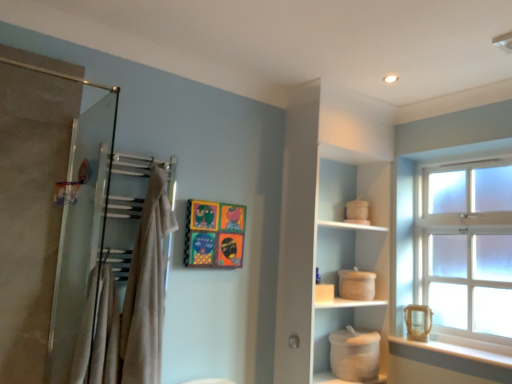
What is the approximate height of beige cotton bath towel at left, which appears as the first bath towel when viewed from the left?

The height of beige cotton bath towel at left, which appears as the first bath towel when viewed from the left, is 22.05 inches.

This screenshot has width=512, height=384. In order to click on white matte pot at lower center in this screenshot , I will do `click(342, 328)`.

You are a GUI agent. You are given a task and a screenshot of the screen. Output one action in this format:
    pyautogui.click(x=<x>, y=<y>)
    Task: Click on the wooden painted picture frame at upper center
    The image size is (512, 384).
    Given the screenshot: What is the action you would take?
    pyautogui.click(x=214, y=234)

Measure the distance between point (446, 264) and camera.

Point (446, 264) is 9.39 feet away from camera.

Describe the element at coordinates (146, 288) in the screenshot. I see `beige cotton bath towel at upper left, marked as the first bath towel in a right-to-left arrangement` at that location.

I want to click on beige cotton bath towel at left, which appears as the first bath towel when viewed from the left, so click(x=98, y=332).

The width and height of the screenshot is (512, 384). I want to click on picture frame above the white matte cabinet at center (from a real-world perspective), so click(x=214, y=234).

Could you tell me if white matte cabinet at center is turned towards wooden painted picture frame at upper center?

No, white matte cabinet at center is not oriented towards wooden painted picture frame at upper center.

Is white matte cabinet at center inside or outside of wooden painted picture frame at upper center?

The correct answer is: outside.

Considering the relative sizes of white matte cabinet at center and wooden painted picture frame at upper center in the image provided, is white matte cabinet at center wider than wooden painted picture frame at upper center?

Correct, the width of white matte cabinet at center exceeds that of wooden painted picture frame at upper center.

Is beige cotton bath towel at left, acting as the second bath towel starting from the right, aimed at white smooth window sill at lower right?

No, beige cotton bath towel at left, acting as the second bath towel starting from the right, is not turned towards white smooth window sill at lower right.

In the image, is beige cotton bath towel at left, which appears as the first bath towel when viewed from the left, positioned in front of or behind white smooth window sill at lower right?

beige cotton bath towel at left, which appears as the first bath towel when viewed from the left, is positioned closer to the viewer than white smooth window sill at lower right.

From the image's perspective, which is below, beige cotton bath towel at left, acting as the second bath towel starting from the right, or white smooth window sill at lower right?

From the image's view, white smooth window sill at lower right is below.

Can you tell me how much white matte pot at lower center and beige cotton bath towel at upper left, which is the second bath towel in left-to-right order, differ in facing direction?

The facing directions of white matte pot at lower center and beige cotton bath towel at upper left, which is the second bath towel in left-to-right order, are 9.57 degrees apart.

Based on the photo, from a real-world perspective, is white matte pot at lower center located beneath beige cotton bath towel at upper left, marked as the first bath towel in a right-to-left arrangement?

Yes.

From the image's perspective, between white matte pot at lower center and beige cotton bath towel at upper left, marked as the first bath towel in a right-to-left arrangement, which one is located above?

beige cotton bath towel at upper left, marked as the first bath towel in a right-to-left arrangement, from the image's perspective.

Is white matte pot at lower center aimed at beige cotton bath towel at upper left, which is the second bath towel in left-to-right order?

No, white matte pot at lower center is not aimed at beige cotton bath towel at upper left, which is the second bath towel in left-to-right order.

Which is less distant, (x=112, y=366) or (x=319, y=195)?

Positioned in front is point (x=112, y=366).

Considering the relative sizes of beige cotton bath towel at left, acting as the second bath towel starting from the right, and white matte cabinet at center in the image provided, is beige cotton bath towel at left, acting as the second bath towel starting from the right, bigger than white matte cabinet at center?

Actually, beige cotton bath towel at left, acting as the second bath towel starting from the right, might be smaller than white matte cabinet at center.

Visually, is beige cotton bath towel at left, acting as the second bath towel starting from the right, positioned to the left or to the right of white matte cabinet at center?

Based on their positions, beige cotton bath towel at left, acting as the second bath towel starting from the right, is located to the left of white matte cabinet at center.

Which of these two, beige cotton bath towel at left, which appears as the first bath towel when viewed from the left, or white matte cabinet at center, stands taller?

Standing taller between the two is white matte cabinet at center.

Is point (340, 209) closer or farther from the camera than point (447, 353)?

Point (340, 209) is farther from the camera than point (447, 353).

In the scene shown: Considering the relative positions of white matte cabinet at center and white smooth window sill at lower right in the image provided, is white matte cabinet at center to the left of white smooth window sill at lower right from the viewer's perspective?

Indeed, white matte cabinet at center is positioned on the left side of white smooth window sill at lower right.

From the image's perspective, would you say white matte cabinet at center is shown under white smooth window sill at lower right?

No.

From the image's perspective, which one is positioned higher, white smooth window sill at lower right or white matte cabinet at center?

From the image's view, white matte cabinet at center is above.

Is white smooth window sill at lower right not inside white matte cabinet at center?

Yes.

Between white smooth window sill at lower right and white matte cabinet at center, which one appears on the right side from the viewer's perspective?

From the viewer's perspective, white smooth window sill at lower right appears more on the right side.

From a real-world perspective, between white smooth window sill at lower right and white matte cabinet at center, who is vertically lower?

white smooth window sill at lower right, from a real-world perspective.

Is white smooth window sill at lower right oriented away from wooden painted picture frame at upper center?

No, white smooth window sill at lower right is not facing away from wooden painted picture frame at upper center.

Consider the image. From the image's perspective, is white smooth window sill at lower right located beneath wooden painted picture frame at upper center?

Yes.

From a real-world perspective, is white smooth window sill at lower right positioned over wooden painted picture frame at upper center based on gravity?

No, from a real-world perspective, white smooth window sill at lower right is not above wooden painted picture frame at upper center.

Between white smooth window sill at lower right and wooden painted picture frame at upper center, which one appears on the left side from the viewer's perspective?

From the viewer's perspective, wooden painted picture frame at upper center appears more on the left side.

Identify the location of cabinet below the wooden painted picture frame at upper center (from the image's perspective). Image resolution: width=512 pixels, height=384 pixels. (353, 224).

From the white smooth window sill at lower right, count 2nd bath towels forward and point to it. Please provide its 2D coordinates.

[(98, 332)]

When comparing their distances from beige cotton bath towel at upper left, marked as the first bath towel in a right-to-left arrangement, does white matte cabinet at center or white smooth window sill at lower right seem closer?

white matte cabinet at center is positioned closer to the anchor beige cotton bath towel at upper left, marked as the first bath towel in a right-to-left arrangement.

When comparing their distances from wooden painted picture frame at upper center, does clear glass window at upper right or white matte pot at lower center seem further?

The object further to wooden painted picture frame at upper center is clear glass window at upper right.

From the picture: Estimate the real-world distances between objects in this image. Which object is further from clear glass window at upper right, white matte cabinet at center or white matte pot at lower center?

Among the two, white matte pot at lower center is located further to clear glass window at upper right.

Considering their positions, is white matte cabinet at center positioned further to white smooth window sill at lower right than wooden painted picture frame at upper center?

wooden painted picture frame at upper center lies further to white smooth window sill at lower right than the other object.

Considering their positions, is beige cotton bath towel at upper left, marked as the first bath towel in a right-to-left arrangement, positioned closer to beige cotton bath towel at left, acting as the second bath towel starting from the right, than wooden painted picture frame at upper center?

The object closer to beige cotton bath towel at left, acting as the second bath towel starting from the right, is beige cotton bath towel at upper left, marked as the first bath towel in a right-to-left arrangement.

When comparing their distances from white smooth window sill at lower right, does beige cotton bath towel at left, acting as the second bath towel starting from the right, or wooden painted picture frame at upper center seem further?

beige cotton bath towel at left, acting as the second bath towel starting from the right, lies further to white smooth window sill at lower right than the other object.

When comparing their distances from white smooth window sill at lower right, does white matte cabinet at center or white matte pot at lower center seem closer?

white matte pot at lower center is closer to white smooth window sill at lower right.

Estimate the real-world distances between objects in this image. Which object is closer to white smooth window sill at lower right, clear glass window at upper right or beige cotton bath towel at upper left, marked as the first bath towel in a right-to-left arrangement?

Based on the image, clear glass window at upper right appears to be nearer to white smooth window sill at lower right.

At what (x,y) coordinates should I click in order to perform the action: click on bath towel between beige cotton bath towel at left, acting as the second bath towel starting from the right, and clear glass window at upper right from left to right. Please return your answer as a coordinate pair (x, y). Looking at the image, I should click on (146, 288).

Find the location of a particular element. cabinet located between beige cotton bath towel at upper left, which is the second bath towel in left-to-right order, and white smooth window sill at lower right in the left-right direction is located at coordinates (353, 224).

Identify the location of window sill situated between white matte cabinet at center and clear glass window at upper right from left to right. (459, 351).

Where is `cabinet between beige cotton bath towel at left, acting as the second bath towel starting from the right, and clear glass window at upper right`? This screenshot has height=384, width=512. cabinet between beige cotton bath towel at left, acting as the second bath towel starting from the right, and clear glass window at upper right is located at coordinates (353, 224).